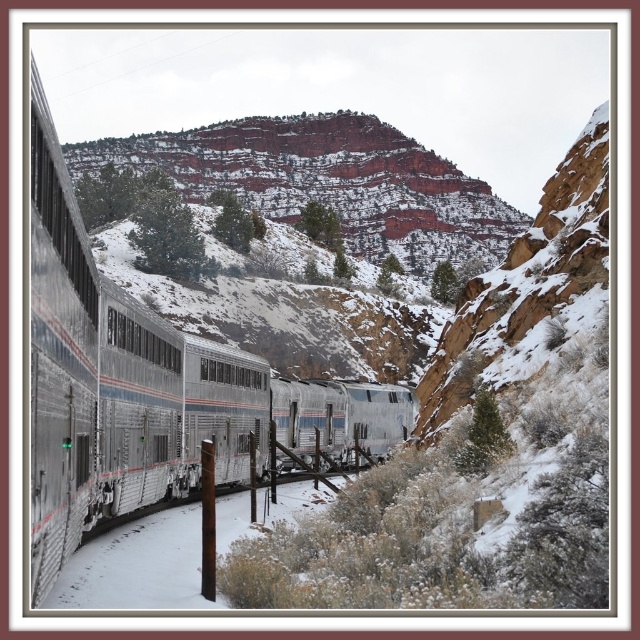
Does silver metallic train at left have a greater width compared to reddish-brown rock formation at upper center?

In fact, silver metallic train at left might be narrower than reddish-brown rock formation at upper center.

Measure the distance between point (330, 451) and camera.

Point (330, 451) and camera are 88.03 meters apart from each other.

Between point (58, 401) and point (204, 198), which one is positioned in front?

Point (58, 401)

The height and width of the screenshot is (640, 640). I want to click on silver metallic train at left, so click(x=118, y=384).